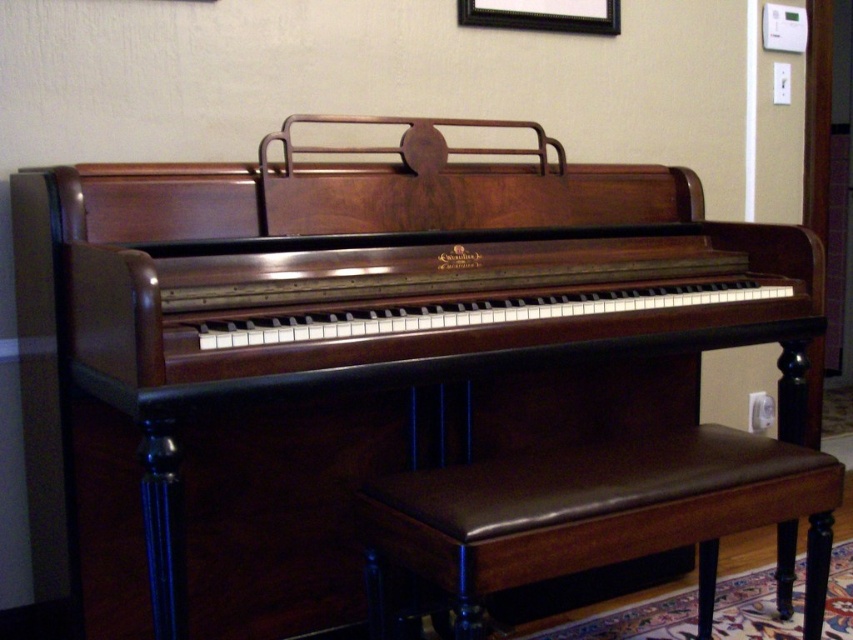
You are a musician preparing to play the piano. You see the brown leather stool at center and the black wood picture frame at upper center. Which object is positioned to the right of the other?

The brown leather stool at center is to the right of the black wood picture frame at upper center.

You are a musician who needs to adjust the distance between your brown leather stool at center and the black wood picture frame at upper center to 5 feet for a performance setup. Based on the current setup shown in the image, is the current distance sufficient? Please explain your reasoning.

The brown leather stool at center and the black wood picture frame at upper center are currently 4.42 feet apart. Since 4.42 feet is less than the required 5 feet, the current distance is insufficient for the performance setup.

You are a professional pianist who wants to sit on the brown leather stool at center to play the piano. However, you notice a black wood picture frame at upper center hanging above the stool. Considering their sizes, do you think the stool might block your view of the picture frame?

The brown leather stool at center is larger in size than the black wood picture frame at upper center. Since the stool is bigger, it could potentially block your view of the smaller picture frame if positioned directly in front of it.